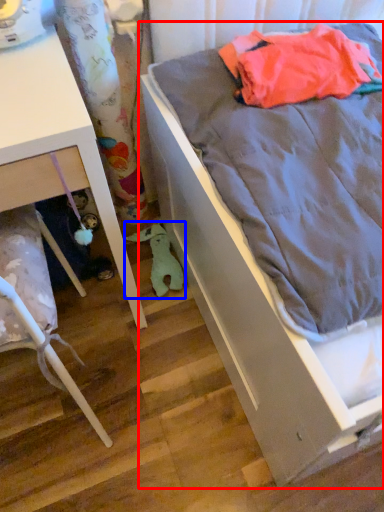
Question: Which of the following is the closest to the observer, bed (highlighted by a red box) or stuff (highlighted by a blue box)?

Choices:
 (A) bed
 (B) stuff

Answer: (A)